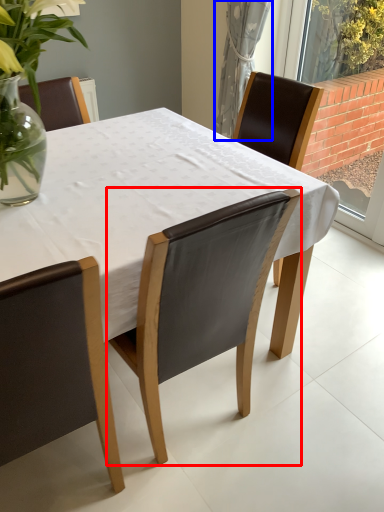
Question: Among these objects, which one is farthest to the camera, chair (highlighted by a red box) or curtain (highlighted by a blue box)?

Choices:
 (A) chair
 (B) curtain

Answer: (B)